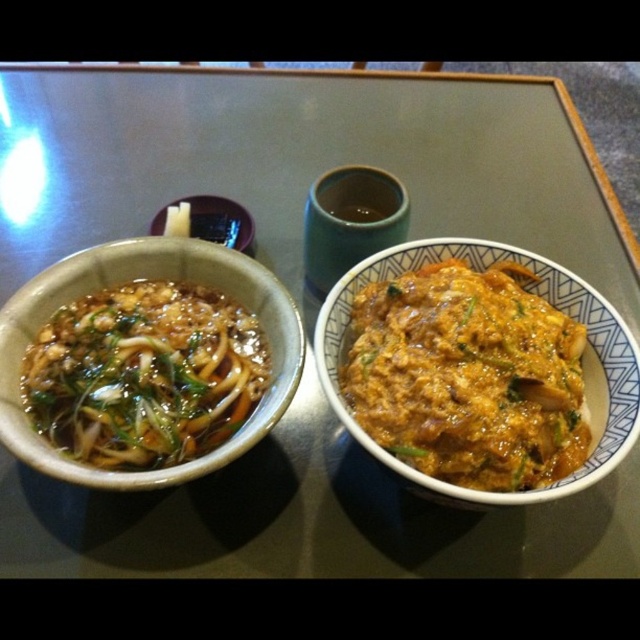
Question: Estimate the real-world distances between objects in this image. Which object is closer to the matte ceramic bowl at center?

Choices:
 (A) matte orange curry at right
 (B) slightly glossy noodles at left

Answer: (B)

Question: Can you confirm if matte orange curry at right is thinner than slightly glossy noodles at left?

Choices:
 (A) yes
 (B) no

Answer: (B)

Question: Which point is closer to the camera?

Choices:
 (A) (138, 460)
 (B) (227, 211)
 (C) (497, 456)

Answer: (C)

Question: Considering the real-world distances, which object is farthest from the slightly glossy noodles at left?

Choices:
 (A) matte orange curry at right
 (B) matte ceramic bowl at center

Answer: (A)

Question: Does matte orange curry at right have a greater width compared to slightly glossy noodles at left?

Choices:
 (A) yes
 (B) no

Answer: (A)

Question: Can you confirm if matte orange curry at right is positioned above matte ceramic bowl at center?

Choices:
 (A) yes
 (B) no

Answer: (B)